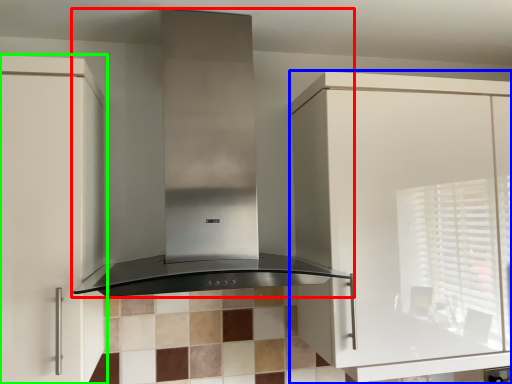
Question: Which is farther away from home appliance (highlighted by a red box)? cabinetry (highlighted by a blue box) or cabinetry (highlighted by a green box)?

Choices:
 (A) cabinetry
 (B) cabinetry

Answer: (A)